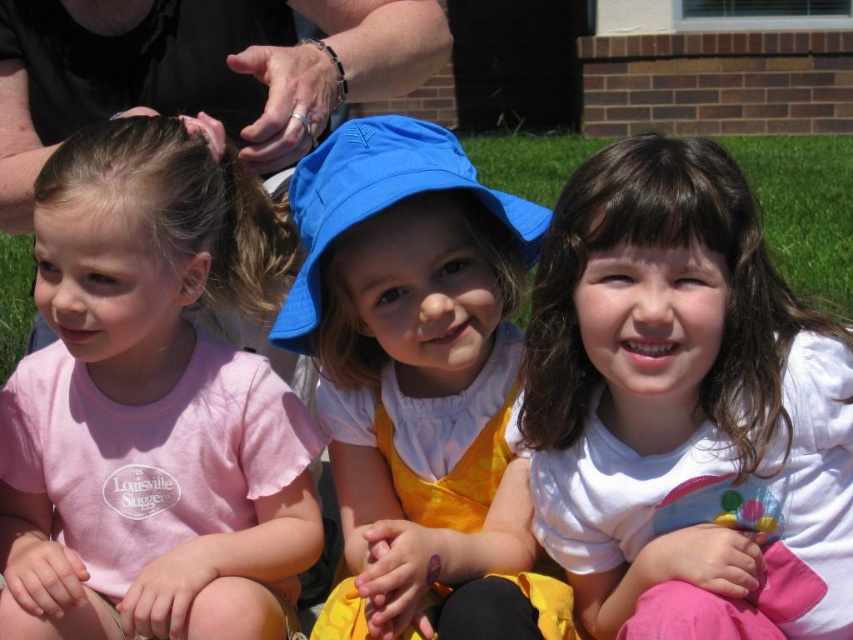
Does white matte shirt at center have a lesser height compared to matte blue sunhat at center?

Yes.

Which of these two, white matte shirt at center or matte blue sunhat at center, stands taller?

matte blue sunhat at center is taller.

Is point (618, 388) positioned in front of point (358, 595)?

Yes, point (618, 388) is closer to viewer.

I want to click on white matte shirt at center, so click(x=685, y=410).

Is point (260, 266) positioned behind point (448, 154)?

Yes, it is.

Consider the image. Can you confirm if pink cotton shirt at left is positioned to the left of matte blue sunhat at center?

Correct, you'll find pink cotton shirt at left to the left of matte blue sunhat at center.

Find the location of a particular element. The width and height of the screenshot is (853, 640). pink cotton shirt at left is located at coordinates (152, 404).

Identify the location of pink cotton shirt at left. The image size is (853, 640). (152, 404).

Which of these two, matte blue sunhat at center or blue fabric hat at center, stands shorter?

Standing shorter between the two is blue fabric hat at center.

At what (x,y) coordinates should I click in order to perform the action: click on matte blue sunhat at center. Please return your answer as a coordinate pair (x, y). Looking at the image, I should click on (419, 384).

You are a GUI agent. You are given a task and a screenshot of the screen. Output one action in this format:
    pyautogui.click(x=<x>, y=<y>)
    Task: Click on the matte blue sunhat at center
    
    Given the screenshot: What is the action you would take?
    pyautogui.click(x=419, y=384)

At what (x,y) coordinates should I click in order to perform the action: click on matte blue sunhat at center. Please return your answer as a coordinate pair (x, y). Looking at the image, I should click on (419, 384).